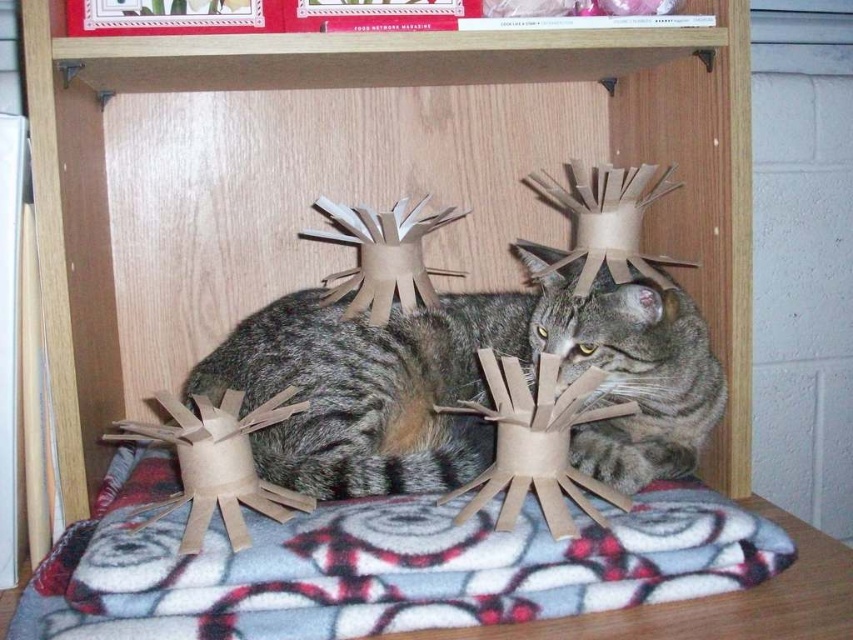
You are an animal caretaker observing the tabby fur cat at center and the tabby fur cat head at center in the image. Which part of the cat is positioned lower?

The tabby fur cat at center is located below the tabby fur cat head at center, so the cat body is lower than its head.

You are a photographer trying to capture a closeup of the tabby fur cat at center and its head, the tabby fur cat head at center. Your camera can only focus on one subject at a time. Which part of the cat should you focus on to ensure both the body and head are in focus, given their distance apart?

Since the tabby fur cat at center and the tabby fur cat head at center are 3.82 inches apart, you should focus on the tabby fur cat head at center because it is closer to the camera, ensuring both the head and body remain in focus.

You are standing in front of the shelf where the tabby cat is resting. There are two points marked on the shelf at coordinates point (660, 326) and point (602, 365). If you want to place a small toy closer to the cat, which point should you choose?

You should choose point (660, 326) because it is closer to the cat than point (602, 365). Since point (660, 326) is further to the camera, it would be nearer to the cat lying on the shelf.